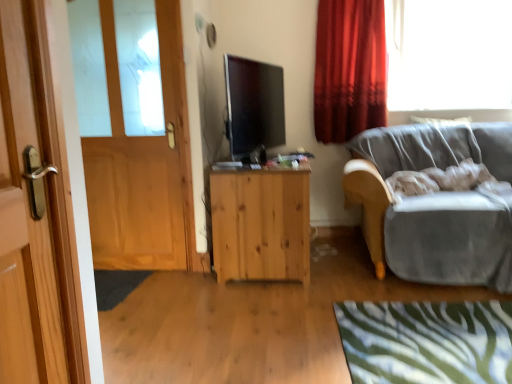
Question: Considering the relative positions of transparent glass window at upper right and velvet gray couch at right in the image provided, is transparent glass window at upper right to the right of velvet gray couch at right from the viewer's perspective?

Choices:
 (A) yes
 (B) no

Answer: (A)

Question: From the image's perspective, is transparent glass window at upper right below velvet gray couch at right?

Choices:
 (A) no
 (B) yes

Answer: (A)

Question: Is transparent glass window at upper right far away from velvet gray couch at right?

Choices:
 (A) yes
 (B) no

Answer: (A)

Question: From the image's perspective, would you say transparent glass window at upper right is positioned over velvet gray couch at right?

Choices:
 (A) yes
 (B) no

Answer: (A)

Question: Does transparent glass window at upper right have a lesser height compared to velvet gray couch at right?

Choices:
 (A) no
 (B) yes

Answer: (B)

Question: Visually, is velvet gray couch at right positioned to the left or to the right of natural wood cabinet at center?

Choices:
 (A) left
 (B) right

Answer: (B)

Question: From the image's perspective, is velvet gray couch at right located above or below natural wood cabinet at center?

Choices:
 (A) below
 (B) above

Answer: (B)

Question: Based on their sizes in the image, would you say velvet gray couch at right is bigger or smaller than natural wood cabinet at center?

Choices:
 (A) big
 (B) small

Answer: (A)

Question: Considering the positions of velvet gray couch at right and natural wood cabinet at center in the image, is velvet gray couch at right taller or shorter than natural wood cabinet at center?

Choices:
 (A) tall
 (B) short

Answer: (A)

Question: Which is correct: natural wood cabinet at center is inside red velvet curtain at upper right, or outside of it?

Choices:
 (A) inside
 (B) outside

Answer: (B)

Question: Is point (253, 183) closer or farther from the camera than point (344, 13)?

Choices:
 (A) closer
 (B) farther

Answer: (A)

Question: From the image's perspective, is natural wood cabinet at center located above or below red velvet curtain at upper right?

Choices:
 (A) below
 (B) above

Answer: (A)

Question: Considering the positions of natural wood cabinet at center and red velvet curtain at upper right in the image, is natural wood cabinet at center bigger or smaller than red velvet curtain at upper right?

Choices:
 (A) big
 (B) small

Answer: (A)

Question: Considering the positions of point (438, 130) and point (1, 354), is point (438, 130) closer or farther from the camera than point (1, 354)?

Choices:
 (A) closer
 (B) farther

Answer: (B)

Question: Considering their positions, is velvet gray couch at right located in front of or behind wooden door at left, arranged as the first door when viewed from the right?

Choices:
 (A) behind
 (B) front

Answer: (A)